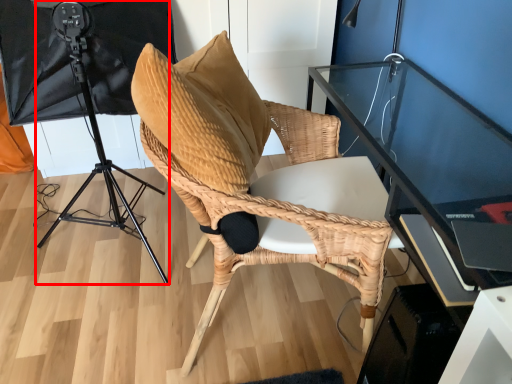
Question: From the image's perspective, where is tripod (annotated by the red box) located in relation to chair in the image?

Choices:
 (A) above
 (B) below

Answer: (A)